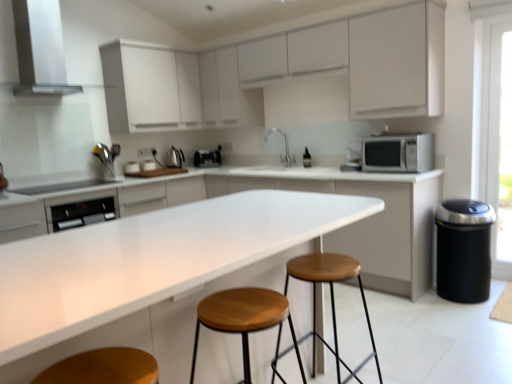
What do you see at coordinates (208, 158) in the screenshot? Image resolution: width=512 pixels, height=384 pixels. I see `satin black toaster at center, placed as the 1th appliance when sorted from back to front` at bounding box center [208, 158].

The height and width of the screenshot is (384, 512). What do you see at coordinates (175, 158) in the screenshot?
I see `satin silver kettle at upper left, placed as the third appliance when sorted from right to left` at bounding box center [175, 158].

How much space does wooden/metallic stool at center, placed as the 1th stool when sorted from back to front, occupy vertically?

The height of wooden/metallic stool at center, placed as the 1th stool when sorted from back to front, is 27.96 inches.

You are a GUI agent. You are given a task and a screenshot of the screen. Output one action in this format:
    pyautogui.click(x=<x>, y=<y>)
    Task: Click on the white matte cabinet at upper left, which is the 3th cabinetry from bottom to top
    
    Given the screenshot: What is the action you would take?
    pyautogui.click(x=150, y=88)

What is the approximate width of white matte cabinet at upper left, which appears as the 1th cabinetry when viewed from the top?

white matte cabinet at upper left, which appears as the 1th cabinetry when viewed from the top, is 15.05 inches wide.

Describe the element at coordinates (464, 250) in the screenshot. The width and height of the screenshot is (512, 384). I see `black matte trash can at lower right, the first appliance ordered from the bottom` at that location.

Where is `satin nickel faucet at center`? satin nickel faucet at center is located at coordinates (285, 146).

You are a GUI agent. You are given a task and a screenshot of the screen. Output one action in this format:
    pyautogui.click(x=<x>, y=<y>)
    Task: Click on the white glossy countertop at center
    
    Given the screenshot: What is the action you would take?
    pyautogui.click(x=150, y=260)

What is the approximate height of white glossy countertop at center?

36.00 inches.

Find the location of a particular element. satin black toaster at center, which is the second appliance from right to left is located at coordinates (208, 158).

From the picture: Could you measure the distance between wooden seat stool at center, positioned as the 1th stool in front-to-back order, and white glossy countertop at center?

wooden seat stool at center, positioned as the 1th stool in front-to-back order, is 15.55 inches away from white glossy countertop at center.

Is wooden seat stool at center, positioned as the 1th stool in front-to-back order, far from white glossy countertop at center?

No, there isn't a large distance between wooden seat stool at center, positioned as the 1th stool in front-to-back order, and white glossy countertop at center.

Find the location of `countertop in front of the wooden seat stool at center, positioned as the 1th stool in front-to-back order`. countertop in front of the wooden seat stool at center, positioned as the 1th stool in front-to-back order is located at coordinates (150, 260).

Which is more to the right, wooden seat stool at center, positioned as the 1th stool in front-to-back order, or white glossy countertop at center?

Positioned to the right is wooden seat stool at center, positioned as the 1th stool in front-to-back order.

Is satin silver kettle at upper left, placed as the 2th appliance when sorted from back to front, at the back of wooden seat stool at center, positioned as the 1th stool in front-to-back order?

wooden seat stool at center, positioned as the 1th stool in front-to-back order, is not turned away from satin silver kettle at upper left, placed as the 2th appliance when sorted from back to front.

From the image's perspective, count 3rd appliances upward from the wooden seat stool at center, which appears as the 2th stool when viewed from the back, and point to it. Please provide its 2D coordinates.

[(175, 158)]

Would you say wooden seat stool at center, positioned as the 1th stool in front-to-back order, is a long distance from satin silver kettle at upper left, placed as the 2th appliance when sorted from back to front?

Yes, wooden seat stool at center, positioned as the 1th stool in front-to-back order, is far from satin silver kettle at upper left, placed as the 2th appliance when sorted from back to front.

Is wooden seat stool at center, positioned as the 1th stool in front-to-back order, shorter than satin silver kettle at upper left, arranged as the second appliance when viewed from the top?

Incorrect, the height of wooden seat stool at center, positioned as the 1th stool in front-to-back order, does not fall short of that of satin silver kettle at upper left, arranged as the second appliance when viewed from the top.

Does white glossy toaster at upper center, the second appliance ordered from the bottom, lie in front of white matte cabinet at upper left, which is the 3th cabinetry from bottom to top?

No, it is not.

From the picture: Is white glossy toaster at upper center, the second appliance ordered from the bottom, at the left side of white matte cabinet at upper left, which appears as the 1th cabinetry when viewed from the top?

Yes.

From the picture: Can you confirm if white glossy toaster at upper center, positioned as the 3th appliance in back-to-front order, is taller than white matte cabinet at upper left, which is the 3th cabinetry from bottom to top?

No, white glossy toaster at upper center, positioned as the 3th appliance in back-to-front order, is not taller than white matte cabinet at upper left, which is the 3th cabinetry from bottom to top.

Can you confirm if satin black toaster at center, the fourth appliance viewed from the front, is smaller than white matte cabinet at upper center, placed as the 2th cabinetry when sorted from bottom to top?

Yes.

Could you tell me if satin black toaster at center, which is the first appliance from top to bottom, is facing white matte cabinet at upper center, placed as the 2th cabinetry when sorted from bottom to top?

No, satin black toaster at center, which is the first appliance from top to bottom, does not turn towards white matte cabinet at upper center, placed as the 2th cabinetry when sorted from bottom to top.

What's the angular difference between satin black toaster at center, which is the second appliance from right to left, and white matte cabinet at upper center, placed as the 2th cabinetry when sorted from bottom to top,'s facing directions?

satin black toaster at center, which is the second appliance from right to left, and white matte cabinet at upper center, placed as the 2th cabinetry when sorted from bottom to top, are facing 47.3 degrees away from each other.

Would you say wooden/metallic stool at center, arranged as the 2th stool when viewed from the front, is outside white matte cabinet at upper center, placed as the 2th cabinetry when sorted from bottom to top?

Yes.

In the scene shown: Is the position of wooden/metallic stool at center, placed as the 1th stool when sorted from back to front, more distant than that of white matte cabinet at upper center, placed as the 2th cabinetry when sorted from bottom to top?

No, it is not.

Looking at their sizes, would you say wooden/metallic stool at center, arranged as the 2th stool when viewed from the front, is wider or thinner than white matte cabinet at upper center, placed as the 2th cabinetry when sorted from bottom to top?

In the image, wooden/metallic stool at center, arranged as the 2th stool when viewed from the front, appears to be more narrow than white matte cabinet at upper center, placed as the 2th cabinetry when sorted from bottom to top.

Is white glossy countertop at center taller than white glossy countertop at center, placed as the third cabinetry when sorted from top to bottom?

No.

Locate an element on the screen. The height and width of the screenshot is (384, 512). the 1st cabinetry positioned above the white glossy countertop at center (from a real-world perspective) is located at coordinates (371, 225).

Which object is positioned more to the right, white glossy countertop at center or white glossy countertop at center, acting as the first cabinetry starting from the bottom?

Positioned to the right is white glossy countertop at center, acting as the first cabinetry starting from the bottom.

Looking at this image, is white glossy countertop at center positioned with its back to white glossy countertop at center, placed as the third cabinetry when sorted from top to bottom?

No.

Can you confirm if white glossy countertop at center is shorter than wooden seat stool at center, which appears as the 2th stool when viewed from the back?

Incorrect, the height of white glossy countertop at center does not fall short of that of wooden seat stool at center, which appears as the 2th stool when viewed from the back.

From a real-world perspective, is white glossy countertop at center above or below wooden seat stool at center, positioned as the 1th stool in front-to-back order?

From a real-world perspective, white glossy countertop at center is physically above wooden seat stool at center, positioned as the 1th stool in front-to-back order.

How far apart are white glossy countertop at center and wooden seat stool at center, which appears as the 2th stool when viewed from the back?

white glossy countertop at center is 15.55 inches away from wooden seat stool at center, which appears as the 2th stool when viewed from the back.

In the image, is white glossy countertop at center positioned in front of or behind wooden seat stool at center, which appears as the 2th stool when viewed from the back?

In the image, white glossy countertop at center appears in front of wooden seat stool at center, which appears as the 2th stool when viewed from the back.

The image size is (512, 384). In the image, there is a wooden seat stool at center, positioned as the 1th stool in front-to-back order. Find the location of `countertop above it (from the image's perspective)`. countertop above it (from the image's perspective) is located at coordinates (150, 260).

Which appliance is the 3rd one when counting from the back of the wooden seat stool at center, positioned as the 1th stool in front-to-back order? Please provide its 2D coordinates.

[(175, 158)]

When comparing their distances from white glossy countertop at center, does wooden/metallic stool at center, placed as the 1th stool when sorted from back to front, or white glossy toaster at upper center, which appears as the 1th appliance when viewed from the left, seem closer?

wooden/metallic stool at center, placed as the 1th stool when sorted from back to front, is closer to white glossy countertop at center.

Looking at the image, which one is located further to white matte cabinet at upper left, which appears as the 1th cabinetry when viewed from the top, white glossy countertop at center, placed as the third cabinetry when sorted from top to bottom, or satin silver kettle at upper left, placed as the 2th appliance when sorted from back to front?

Among the two, white glossy countertop at center, placed as the third cabinetry when sorted from top to bottom, is located further to white matte cabinet at upper left, which appears as the 1th cabinetry when viewed from the top.

Estimate the real-world distances between objects in this image. Which object is further from white matte cabinet at upper center, the second cabinetry when ordered from top to bottom, white glossy countertop at center, placed as the third cabinetry when sorted from top to bottom, or wooden/metallic stool at center, placed as the 1th stool when sorted from back to front?

The object further to white matte cabinet at upper center, the second cabinetry when ordered from top to bottom, is wooden/metallic stool at center, placed as the 1th stool when sorted from back to front.

Which object lies nearer to the anchor point white matte cabinet at upper left, which is the 3th cabinetry from bottom to top, white glossy countertop at center, acting as the first cabinetry starting from the bottom, or silver metallic microwave at right?

white glossy countertop at center, acting as the first cabinetry starting from the bottom, is closer to white matte cabinet at upper left, which is the 3th cabinetry from bottom to top.

Estimate the real-world distances between objects in this image. Which object is further from wooden/metallic stool at center, placed as the 1th stool when sorted from back to front, white matte cabinet at upper left, which appears as the 1th cabinetry when viewed from the top, or white glossy countertop at center?

white matte cabinet at upper left, which appears as the 1th cabinetry when viewed from the top, lies further to wooden/metallic stool at center, placed as the 1th stool when sorted from back to front, than the other object.

When comparing their distances from silver metallic microwave at right, does wooden/metallic stool at center, placed as the 1th stool when sorted from back to front, or satin silver kettle at upper left, which ranks as the third appliance in bottom-to-top order, seem closer?

wooden/metallic stool at center, placed as the 1th stool when sorted from back to front.

Based on their spatial positions, is stainless steel exhaust hood at upper left or satin black toaster at center, which is the second appliance from right to left, closer to white matte cabinet at upper left, which appears as the 1th cabinetry when viewed from the top?

The object closer to white matte cabinet at upper left, which appears as the 1th cabinetry when viewed from the top, is stainless steel exhaust hood at upper left.

Looking at the image, which one is located closer to wooden seat stool at center, positioned as the 1th stool in front-to-back order, black matte trash can at lower right, the first appliance ordered from the bottom, or white glossy countertop at center, placed as the third cabinetry when sorted from top to bottom?

white glossy countertop at center, placed as the third cabinetry when sorted from top to bottom, lies closer to wooden seat stool at center, positioned as the 1th stool in front-to-back order, than the other object.

What are the coordinates of `sink between wooden/metallic stool at center, arranged as the 2th stool when viewed from the front, and white glossy toaster at upper center, which appears as the 1th appliance when viewed from the left, from front to back` in the screenshot? It's located at (285, 146).

Find the location of a particular element. microwave oven between wooden/metallic stool at center, placed as the 1th stool when sorted from back to front, and satin silver kettle at upper left, placed as the third appliance when sorted from right to left, from front to back is located at coordinates (398, 153).

You are a GUI agent. You are given a task and a screenshot of the screen. Output one action in this format:
    pyautogui.click(x=<x>, y=<y>)
    Task: Click on the microwave oven positioned between wooden seat stool at center, which appears as the 2th stool when viewed from the back, and satin silver kettle at upper left, which is the second appliance from left to right, from near to far
    The height and width of the screenshot is (384, 512).
    Given the screenshot: What is the action you would take?
    point(398,153)

Image resolution: width=512 pixels, height=384 pixels. Identify the location of microwave oven between white matte cabinet at upper center, placed as the 2th cabinetry when sorted from bottom to top, and wooden/metallic stool at center, placed as the 1th stool when sorted from back to front, in the up-down direction. (398, 153).